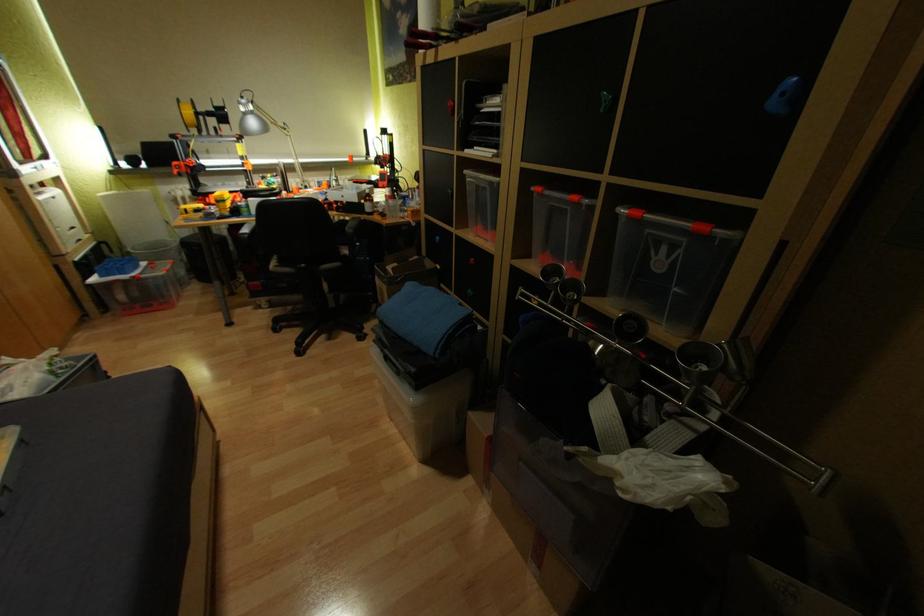
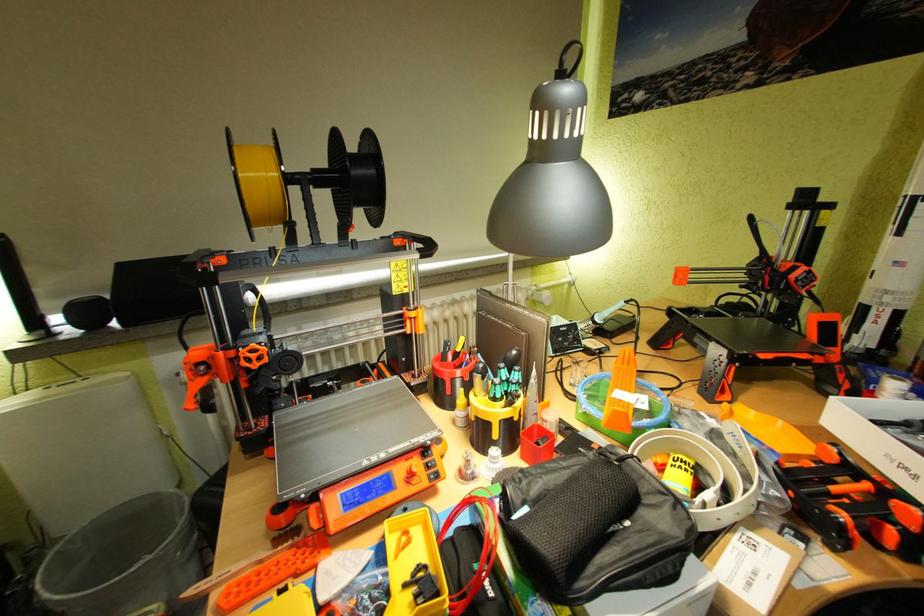
In a continuous first-person perspective shot, in which direction is the camera moving?

The cameraman walked toward left, forward.